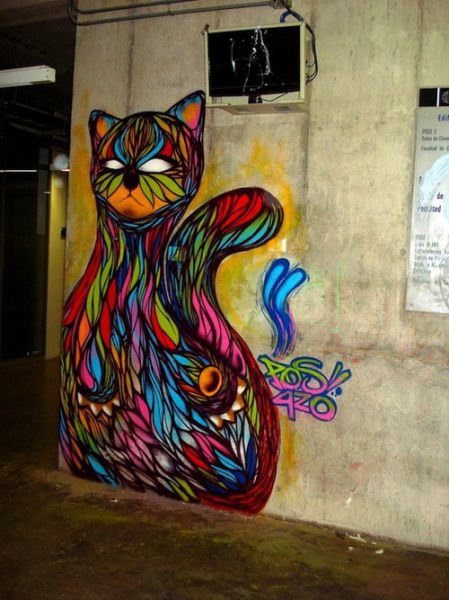
Identify the location of floor. The height and width of the screenshot is (600, 449). (159, 556).